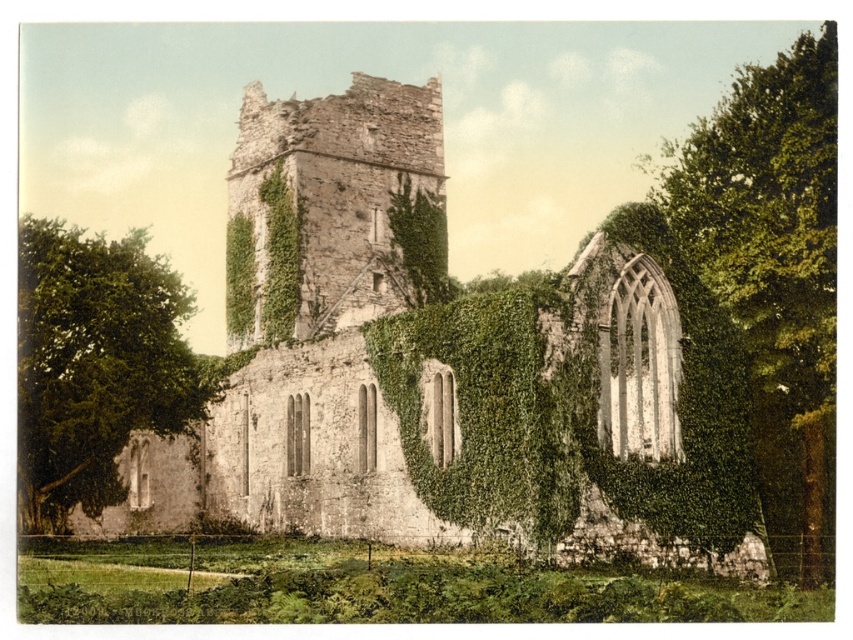
You are standing in front of the ruins of an old stone building. You see a green leafy tree at right and a green leafy tree at left. Which tree is positioned more to the east?

The green leafy tree at right is positioned to the right of the green leafy tree at left, so the green leafy tree at right is more to the east.